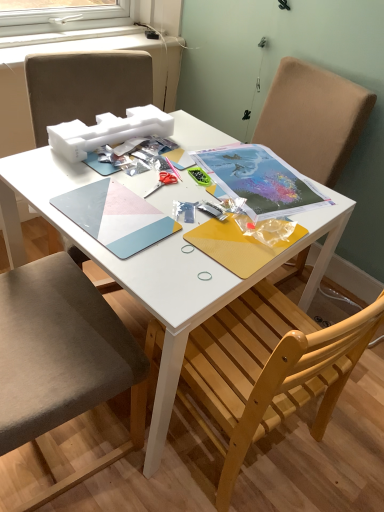
The width and height of the screenshot is (384, 512). What are the coordinates of `vacant area on the back side of matte plastic notebook at center, the 2th notebook when ordered from right to left` in the screenshot? It's located at (135, 178).